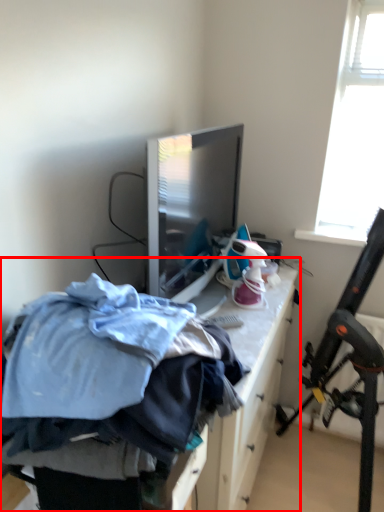
Question: From the image's perspective, what is the correct spatial relationship of furniture (annotated by the red box) in relation to folding chair?

Choices:
 (A) below
 (B) above

Answer: (B)